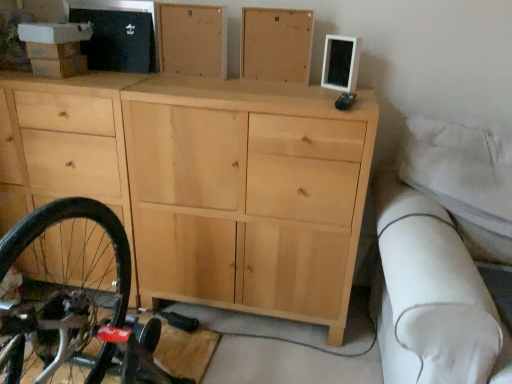
Question: Considering the positions of natural wood cabinet at upper center, which is the second chest of drawer in left-to-right order, and natural wood cabinet at upper center, which ranks as the first chest of drawer in left-to-right order, in the image, is natural wood cabinet at upper center, which is the second chest of drawer in left-to-right order, bigger or smaller than natural wood cabinet at upper center, which ranks as the first chest of drawer in left-to-right order,?

Choices:
 (A) small
 (B) big

Answer: (A)

Question: From the image's perspective, is natural wood cabinet at upper center, which is counted as the 1th chest of drawer, starting from the right, located above or below natural wood cabinet at upper center, which ranks as the first chest of drawer in left-to-right order?

Choices:
 (A) below
 (B) above

Answer: (A)

Question: Which object is the farthest from the natural wood cabinet at upper center, which is the second chest of drawer in left-to-right order?

Choices:
 (A) natural wood cabinet at upper center, which ranks as the first chest of drawer in left-to-right order
 (B) natural wood cabinet at center

Answer: (B)

Question: Based on their relative distances, which object is nearer to the natural wood cabinet at upper center, which is the second chest of drawer in left-to-right order?

Choices:
 (A) natural wood cabinet at center
 (B) natural wood cabinet at upper center, which is the second chest of drawer from right to left

Answer: (B)